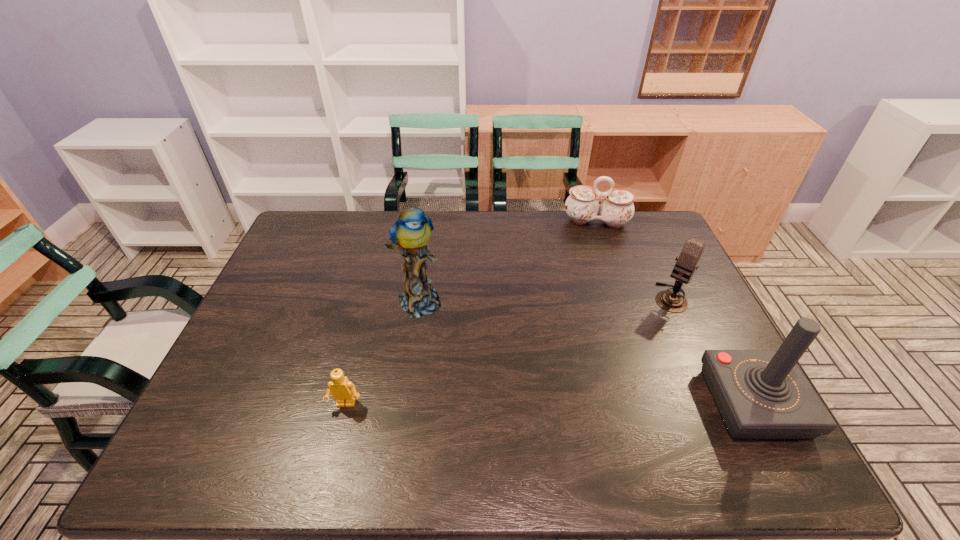
The width and height of the screenshot is (960, 540). In order to click on free space located on the front-facing side of the third shortest object in this screenshot , I will do `click(620, 366)`.

Locate an element on the screen. This screenshot has height=540, width=960. blank space located by the handle of the fourth tallest object is located at coordinates (594, 249).

You are a GUI agent. You are given a task and a screenshot of the screen. Output one action in this format:
    pyautogui.click(x=<x>, y=<y>)
    Task: Click on the free spot located by the handle of the fourth tallest object
    The width and height of the screenshot is (960, 540).
    Given the screenshot: What is the action you would take?
    pyautogui.click(x=594, y=283)

At what (x,y) coordinates should I click in order to perform the action: click on vacant space situated by the handle of the fourth tallest object. Please return your answer as a coordinate pair (x, y). This screenshot has width=960, height=540. Looking at the image, I should click on (594, 303).

This screenshot has width=960, height=540. I want to click on vacant space located on the face of the parrot, so pyautogui.click(x=459, y=353).

This screenshot has width=960, height=540. In order to click on free space located on the face of the parrot in this screenshot , I will do coord(483,382).

At what (x,y) coordinates should I click in order to perform the action: click on vacant space situated 0.320m on the face of the parrot. Please return your answer as a coordinate pair (x, y). Looking at the image, I should click on (497, 399).

Image resolution: width=960 pixels, height=540 pixels. What are the coordinates of `object present at the far edge` in the screenshot? It's located at tap(582, 206).

Image resolution: width=960 pixels, height=540 pixels. Identify the location of Lego that is at the near edge. click(343, 391).

Image resolution: width=960 pixels, height=540 pixels. What are the coordinates of `joystick that is at the near edge` in the screenshot? It's located at (761, 394).